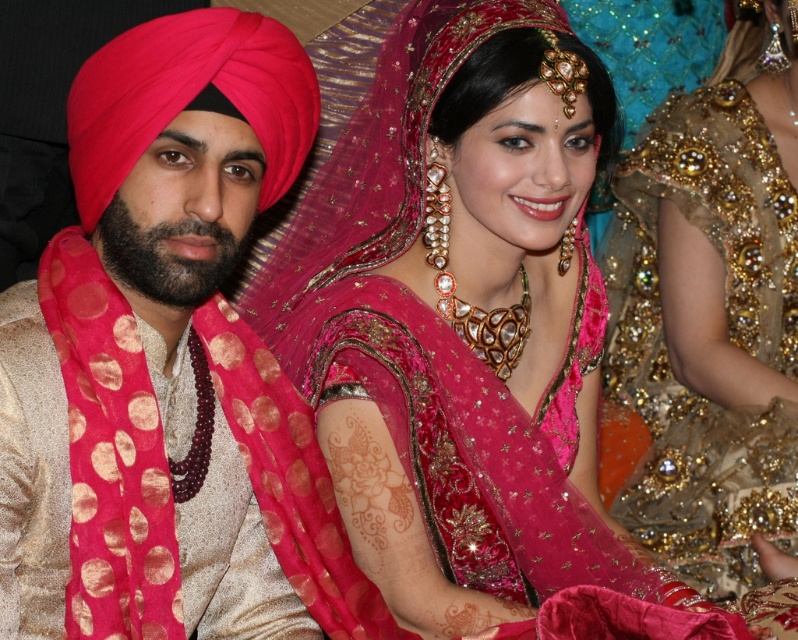
Is matte pink fabric at center bigger than gold sequined lehenga at right?

No, matte pink fabric at center is not bigger than gold sequined lehenga at right.

Is matte pink fabric at center behind gold sequined lehenga at right?

No.

Which is behind, point (674, 628) or point (785, 140)?

Positioned behind is point (785, 140).

The image size is (798, 640). What are the coordinates of `matte pink fabric at center` in the screenshot? It's located at (468, 342).

Between point (650, 376) and point (255, 54), which one is positioned in front?

Point (255, 54) is more forward.

Is gold sequined lehenga at right taller than matte pink turban at left?

Yes, gold sequined lehenga at right is taller than matte pink turban at left.

Find the location of a particular element. The height and width of the screenshot is (640, 798). gold sequined lehenga at right is located at coordinates (712, 316).

Where is `gold sequined lehenga at right`? The height and width of the screenshot is (640, 798). gold sequined lehenga at right is located at coordinates (712, 316).

Who is lower down, matte gold kurta at center or gold sequined lehenga at right?

matte gold kurta at center

Who is more distant from viewer, [10,499] or [733,202]?

The point [733,202] is more distant.

The height and width of the screenshot is (640, 798). I want to click on matte gold kurta at center, so click(x=148, y=344).